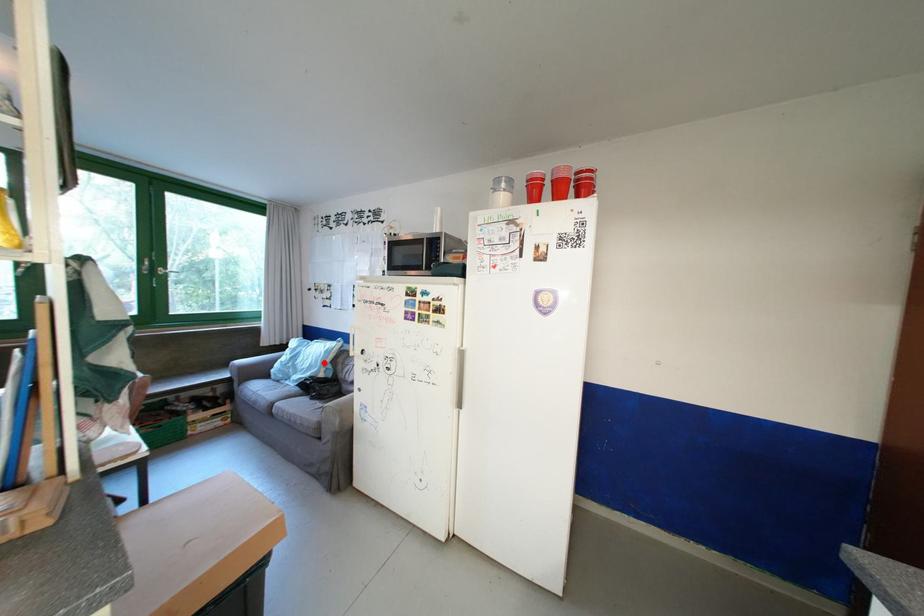
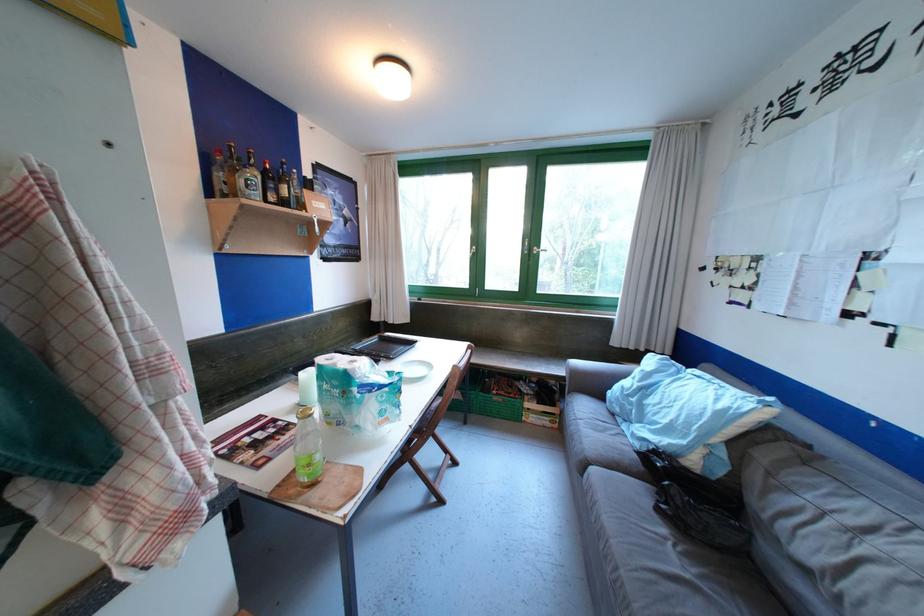
Locate, in the second image, the point that corresponds to the highlighted location in the first image.

(697, 426)